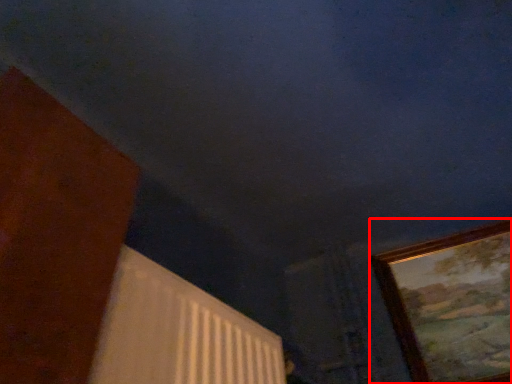
Question: Where is picture frame (annotated by the red box) located in relation to radiator in the image?

Choices:
 (A) left
 (B) right

Answer: (B)